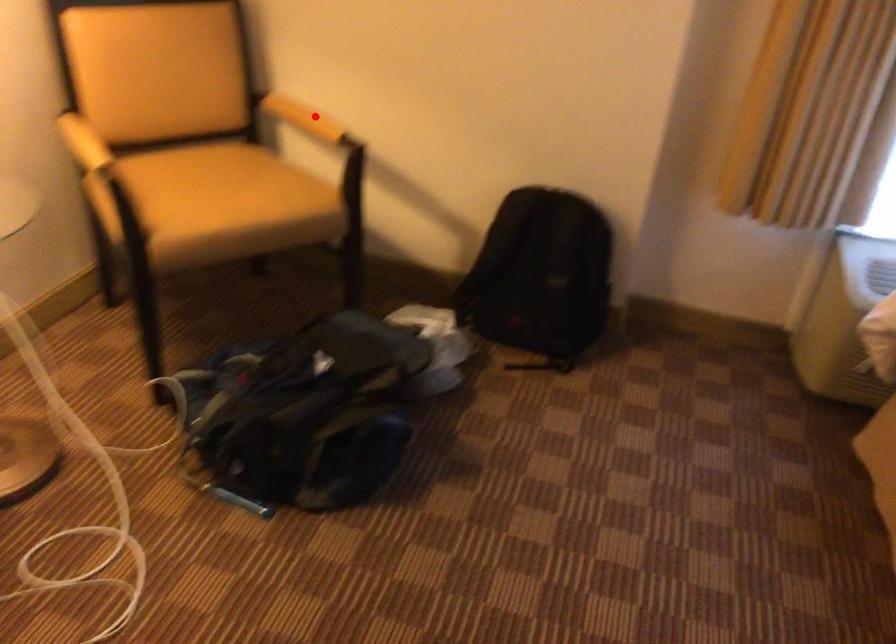
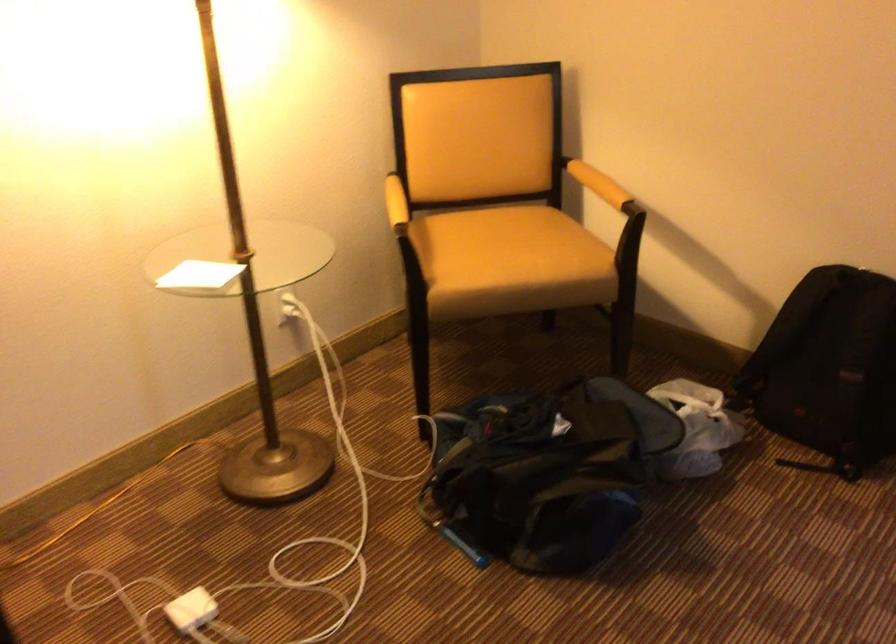
Find the pixel in the second image that matches the highlighted location in the first image.

(598, 184)